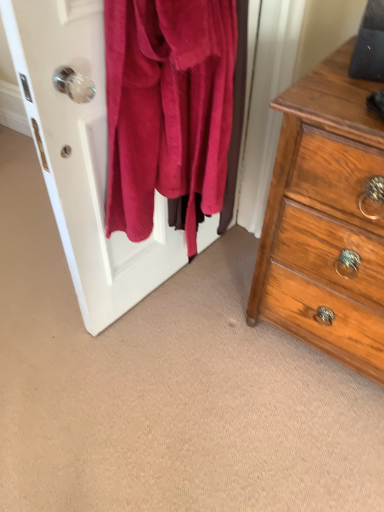
Question: Should I look upward or downward to see wooden chest of drawers at right?

Choices:
 (A) up
 (B) down

Answer: (A)

Question: Is fuzzy pink sweater at left oriented towards wooden chest of drawers at right?

Choices:
 (A) no
 (B) yes

Answer: (A)

Question: Is fuzzy pink sweater at left not near wooden chest of drawers at right?

Choices:
 (A) no
 (B) yes

Answer: (A)

Question: Can you confirm if fuzzy pink sweater at left is bigger than wooden chest of drawers at right?

Choices:
 (A) yes
 (B) no

Answer: (B)

Question: Is fuzzy pink sweater at left taller than wooden chest of drawers at right?

Choices:
 (A) no
 (B) yes

Answer: (A)

Question: Is fuzzy pink sweater at left wider than wooden chest of drawers at right?

Choices:
 (A) yes
 (B) no

Answer: (B)

Question: Is fuzzy pink sweater at left further to camera compared to wooden chest of drawers at right?

Choices:
 (A) no
 (B) yes

Answer: (A)

Question: Can fuzzy pink sweater at left be found inside wooden chest of drawers at right?

Choices:
 (A) yes
 (B) no

Answer: (B)

Question: Are wooden chest of drawers at right and fuzzy pink sweater at left far apart?

Choices:
 (A) no
 (B) yes

Answer: (A)

Question: Is wooden chest of drawers at right facing towards fuzzy pink sweater at left?

Choices:
 (A) no
 (B) yes

Answer: (A)

Question: Is the surface of wooden chest of drawers at right in direct contact with fuzzy pink sweater at left?

Choices:
 (A) yes
 (B) no

Answer: (B)

Question: Considering the relative sizes of wooden chest of drawers at right and fuzzy pink sweater at left in the image provided, is wooden chest of drawers at right bigger than fuzzy pink sweater at left?

Choices:
 (A) no
 (B) yes

Answer: (B)

Question: Does wooden chest of drawers at right have a lesser width compared to fuzzy pink sweater at left?

Choices:
 (A) yes
 (B) no

Answer: (B)

Question: Is wooden chest of drawers at right situated inside fuzzy pink sweater at left or outside?

Choices:
 (A) inside
 (B) outside

Answer: (B)